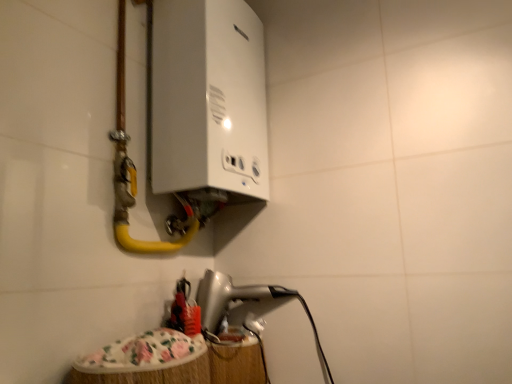
You are a GUI agent. You are given a task and a screenshot of the screen. Output one action in this format:
    pyautogui.click(x=<x>, y=<y>)
    Task: Click on the white glossy boiler at upper center, the 2th appliance in the bottom-to-top sequence
    The image size is (512, 384).
    Given the screenshot: What is the action you would take?
    pyautogui.click(x=208, y=99)

Identify the location of silver metallic hairdryer at lower center, which appears as the second appliance when viewed from the top. This screenshot has width=512, height=384. (230, 296).

Where is `white glossy boiler at upper center, marked as the 1th appliance in a top-to-bottom arrangement`? white glossy boiler at upper center, marked as the 1th appliance in a top-to-bottom arrangement is located at coordinates (208, 99).

Considering their positions, is white glossy boiler at upper center, marked as the 1th appliance in a top-to-bottom arrangement, located in front of or behind yellow rubber hose at upper left?

Clearly, white glossy boiler at upper center, marked as the 1th appliance in a top-to-bottom arrangement, is behind yellow rubber hose at upper left.

Which of these two, white glossy boiler at upper center, the 2th appliance in the bottom-to-top sequence, or yellow rubber hose at upper left, is bigger?

Bigger between the two is yellow rubber hose at upper left.

Would you say white glossy boiler at upper center, the 2th appliance in the bottom-to-top sequence, is outside yellow rubber hose at upper left?

No, white glossy boiler at upper center, the 2th appliance in the bottom-to-top sequence, is not outside of yellow rubber hose at upper left.

From the image's perspective, is white glossy boiler at upper center, the 2th appliance in the bottom-to-top sequence, over yellow rubber hose at upper left?

Indeed, from the image's perspective, white glossy boiler at upper center, the 2th appliance in the bottom-to-top sequence, is shown above yellow rubber hose at upper left.

Considering the sizes of objects yellow rubber hose at upper left and white glossy boiler at upper center, marked as the 1th appliance in a top-to-bottom arrangement, in the image provided, who is shorter, yellow rubber hose at upper left or white glossy boiler at upper center, marked as the 1th appliance in a top-to-bottom arrangement,?

white glossy boiler at upper center, marked as the 1th appliance in a top-to-bottom arrangement.

Can you confirm if yellow rubber hose at upper left is wider than white glossy boiler at upper center, marked as the 1th appliance in a top-to-bottom arrangement?

In fact, yellow rubber hose at upper left might be narrower than white glossy boiler at upper center, marked as the 1th appliance in a top-to-bottom arrangement.

I want to click on water pipe directly beneath the white glossy boiler at upper center, the 2th appliance in the bottom-to-top sequence (from a real-world perspective), so click(136, 172).

Is yellow rubber hose at upper left at the left side of silver metallic hairdryer at lower center, which appears as the second appliance when viewed from the top?

Indeed, yellow rubber hose at upper left is positioned on the left side of silver metallic hairdryer at lower center, which appears as the second appliance when viewed from the top.

From a real-world perspective, relative to silver metallic hairdryer at lower center, which appears as the second appliance when viewed from the top, is yellow rubber hose at upper left vertically above or below?

In terms of real-world spatial position, yellow rubber hose at upper left is above silver metallic hairdryer at lower center, which appears as the second appliance when viewed from the top.

Which of these two, yellow rubber hose at upper left or silver metallic hairdryer at lower center, which appears as the second appliance when viewed from the top, is smaller?

Smaller between the two is silver metallic hairdryer at lower center, which appears as the second appliance when viewed from the top.

Can you see yellow rubber hose at upper left touching silver metallic hairdryer at lower center, which is the first appliance in bottom-to-top order?

yellow rubber hose at upper left is not next to silver metallic hairdryer at lower center, which is the first appliance in bottom-to-top order, and they're not touching.

Which point is more distant from viewer, (200, 301) or (163, 34)?

The point (200, 301) is more distant.

Are silver metallic hairdryer at lower center, which appears as the second appliance when viewed from the top, and white glossy boiler at upper center, the 2th appliance in the bottom-to-top sequence, beside each other?

silver metallic hairdryer at lower center, which appears as the second appliance when viewed from the top, and white glossy boiler at upper center, the 2th appliance in the bottom-to-top sequence, are not in contact.

Does silver metallic hairdryer at lower center, which is the first appliance in bottom-to-top order, come in front of white glossy boiler at upper center, marked as the 1th appliance in a top-to-bottom arrangement?

No.

What's the angular difference between white glossy boiler at upper center, marked as the 1th appliance in a top-to-bottom arrangement, and silver metallic hairdryer at lower center, which appears as the second appliance when viewed from the top,'s facing directions?

The angular difference between white glossy boiler at upper center, marked as the 1th appliance in a top-to-bottom arrangement, and silver metallic hairdryer at lower center, which appears as the second appliance when viewed from the top, is 5.85 degrees.

Does white glossy boiler at upper center, the 2th appliance in the bottom-to-top sequence, come behind silver metallic hairdryer at lower center, which is the first appliance in bottom-to-top order?

No, it is not.

Between white glossy boiler at upper center, marked as the 1th appliance in a top-to-bottom arrangement, and silver metallic hairdryer at lower center, which appears as the second appliance when viewed from the top, which one has less height?

silver metallic hairdryer at lower center, which appears as the second appliance when viewed from the top.

Is white glossy boiler at upper center, the 2th appliance in the bottom-to-top sequence, touching silver metallic hairdryer at lower center, which appears as the second appliance when viewed from the top?

No, white glossy boiler at upper center, the 2th appliance in the bottom-to-top sequence, is not beside silver metallic hairdryer at lower center, which appears as the second appliance when viewed from the top.

Identify the location of the 2nd appliance to the right when counting from the yellow rubber hose at upper left. pos(230,296).

Which of these two, silver metallic hairdryer at lower center, which is the first appliance in bottom-to-top order, or yellow rubber hose at upper left, is bigger?

yellow rubber hose at upper left is bigger.

Looking at this image, from their relative heights in the image, would you say silver metallic hairdryer at lower center, which is the first appliance in bottom-to-top order, is taller or shorter than yellow rubber hose at upper left?

Considering their sizes, silver metallic hairdryer at lower center, which is the first appliance in bottom-to-top order, has less height than yellow rubber hose at upper left.

Is silver metallic hairdryer at lower center, which appears as the second appliance when viewed from the top, facing away from yellow rubber hose at upper left?

silver metallic hairdryer at lower center, which appears as the second appliance when viewed from the top, is not turned away from yellow rubber hose at upper left.

Locate an element on the screen. This screenshot has width=512, height=384. appliance that is above the yellow rubber hose at upper left (from a real-world perspective) is located at coordinates (208, 99).

Find the location of `appliance above the yellow rubber hose at upper left (from the image's perspective)`. appliance above the yellow rubber hose at upper left (from the image's perspective) is located at coordinates (208, 99).

Estimate the real-world distances between objects in this image. Which object is further from silver metallic hairdryer at lower center, which is the first appliance in bottom-to-top order, yellow rubber hose at upper left or white glossy boiler at upper center, the 2th appliance in the bottom-to-top sequence?

Among the two, white glossy boiler at upper center, the 2th appliance in the bottom-to-top sequence, is located further to silver metallic hairdryer at lower center, which is the first appliance in bottom-to-top order.

From the picture: Looking at the image, which one is located closer to yellow rubber hose at upper left, white glossy boiler at upper center, the 2th appliance in the bottom-to-top sequence, or silver metallic hairdryer at lower center, which is the first appliance in bottom-to-top order?

white glossy boiler at upper center, the 2th appliance in the bottom-to-top sequence, lies closer to yellow rubber hose at upper left than the other object.

From the image, which object appears to be nearer to white glossy boiler at upper center, marked as the 1th appliance in a top-to-bottom arrangement, yellow rubber hose at upper left or silver metallic hairdryer at lower center, which appears as the second appliance when viewed from the top?

Based on the image, yellow rubber hose at upper left appears to be nearer to white glossy boiler at upper center, marked as the 1th appliance in a top-to-bottom arrangement.

Estimate the real-world distances between objects in this image. Which object is further from white glossy boiler at upper center, the 2th appliance in the bottom-to-top sequence, silver metallic hairdryer at lower center, which is the first appliance in bottom-to-top order, or yellow rubber hose at upper left?

Among the two, silver metallic hairdryer at lower center, which is the first appliance in bottom-to-top order, is located further to white glossy boiler at upper center, the 2th appliance in the bottom-to-top sequence.

Estimate the real-world distances between objects in this image. Which object is further from yellow rubber hose at upper left, silver metallic hairdryer at lower center, which appears as the second appliance when viewed from the top, or white glossy boiler at upper center, the 2th appliance in the bottom-to-top sequence?

Based on the image, silver metallic hairdryer at lower center, which appears as the second appliance when viewed from the top, appears to be further to yellow rubber hose at upper left.

Considering their positions, is white glossy boiler at upper center, marked as the 1th appliance in a top-to-bottom arrangement, positioned further to silver metallic hairdryer at lower center, which is the first appliance in bottom-to-top order, than yellow rubber hose at upper left?

The object further to silver metallic hairdryer at lower center, which is the first appliance in bottom-to-top order, is white glossy boiler at upper center, marked as the 1th appliance in a top-to-bottom arrangement.

The width and height of the screenshot is (512, 384). Identify the location of water pipe between white glossy boiler at upper center, marked as the 1th appliance in a top-to-bottom arrangement, and silver metallic hairdryer at lower center, which is the first appliance in bottom-to-top order, in the up-down direction. (136, 172).